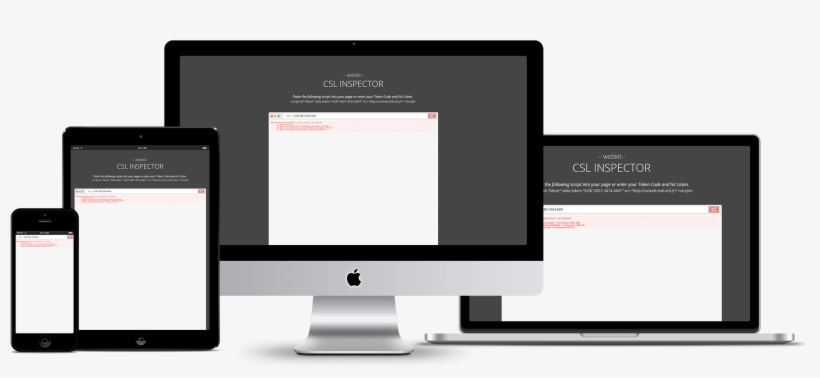
The width and height of the screenshot is (820, 378). I want to click on monitor, so click(439, 151).